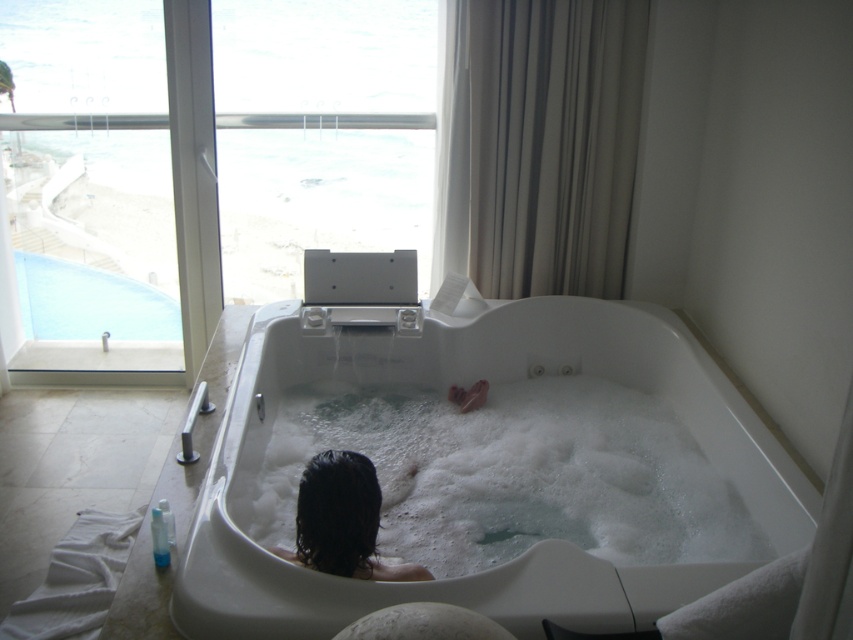
Question: Does transparent glass door at upper left appear on the right side of white glossy jacuzzi at center?

Choices:
 (A) yes
 (B) no

Answer: (B)

Question: Which object is closer to the camera taking this photo?

Choices:
 (A) white glossy jacuzzi at center
 (B) dark matte hair at center

Answer: (A)

Question: Among these objects, which one is nearest to the camera?

Choices:
 (A) transparent glass door at upper left
 (B) dark matte hair at center
 (C) white glossy jacuzzi at center

Answer: (C)

Question: Which object is farther from the camera taking this photo?

Choices:
 (A) transparent glass door at upper left
 (B) white foamy bath at center

Answer: (A)

Question: Is the position of transparent glass window at upper center less distant than that of dark matte hair at center?

Choices:
 (A) yes
 (B) no

Answer: (B)

Question: Does white glossy jacuzzi at center have a larger size compared to transparent glass window at upper center?

Choices:
 (A) no
 (B) yes

Answer: (B)